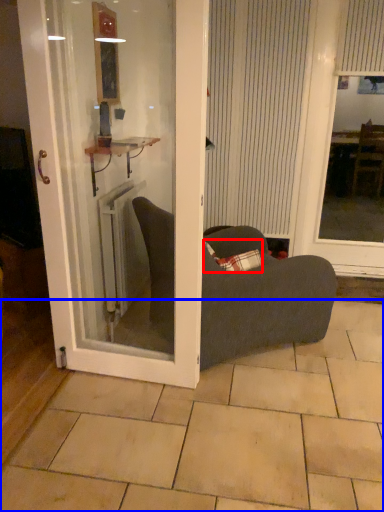
Question: Which point is further to the camera, pillow (highlighted by a red box) or tile (highlighted by a blue box)?

Choices:
 (A) pillow
 (B) tile

Answer: (A)